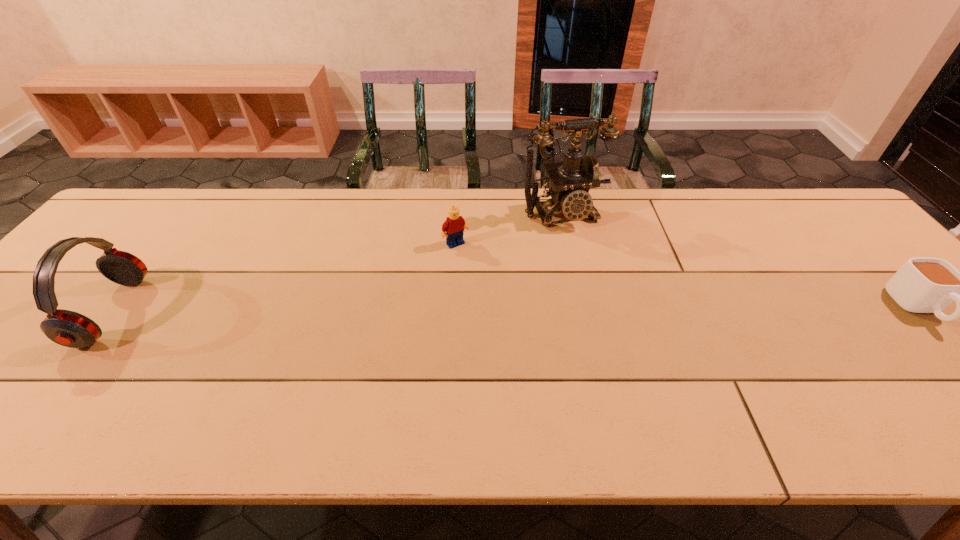
Locate an element on the screen. vacant space that is in between the third object from right to left and the tallest object is located at coordinates (509, 228).

At what (x,y) coordinates should I click in order to perform the action: click on blank region between the farthest object and the second tallest object. Please return your answer as a coordinate pair (x, y). This screenshot has width=960, height=540. Looking at the image, I should click on (337, 262).

You are a GUI agent. You are given a task and a screenshot of the screen. Output one action in this format:
    pyautogui.click(x=<x>, y=<y>)
    Task: Click on the unoccupied area between the earphone and the tallest object
    
    Given the screenshot: What is the action you would take?
    (337, 262)

Where is `vacant space that is in between the second farthest object and the leftmost object`? The width and height of the screenshot is (960, 540). vacant space that is in between the second farthest object and the leftmost object is located at coordinates tap(283, 278).

The image size is (960, 540). What are the coordinates of `free space between the leftmost object and the Lego` in the screenshot? It's located at (283, 278).

The image size is (960, 540). What are the coordinates of `vacant point located between the third object from left to right and the earphone` in the screenshot? It's located at (337, 262).

The height and width of the screenshot is (540, 960). I want to click on the third closest object to the third object from left to right, so click(67, 328).

The image size is (960, 540). Find the location of `object that is the closest to the rightmost object`. object that is the closest to the rightmost object is located at coordinates (570, 181).